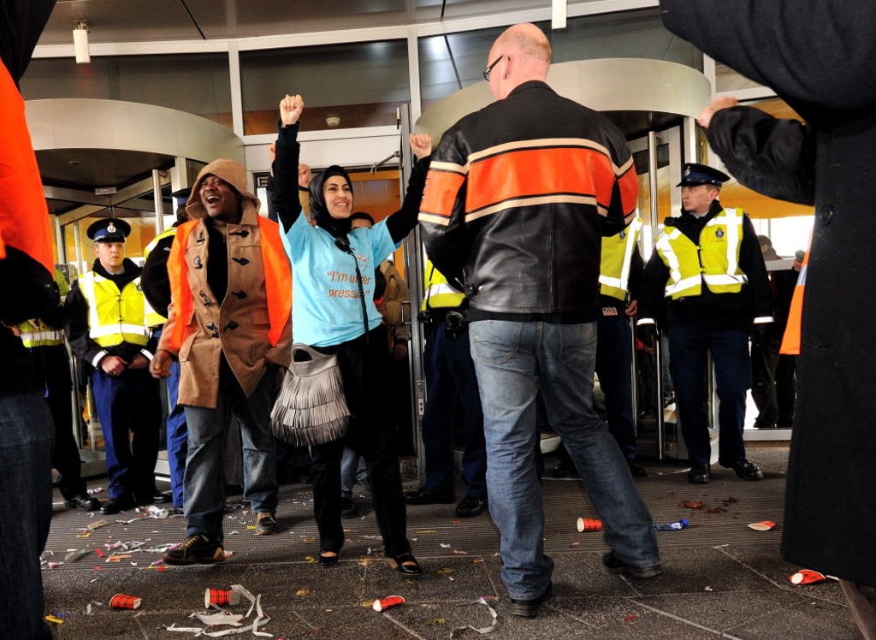
Question: Can you confirm if orange reflective vest at center is smaller than high-visibility yellow safety vest at left?

Choices:
 (A) yes
 (B) no

Answer: (B)

Question: Which of the following is the closest to the observer?

Choices:
 (A) high-visibility yellow vest at center
 (B) leather jacket at center
 (C) orange reflective vest at center

Answer: (B)

Question: Observing the image, what is the correct spatial positioning of high-visibility yellow vest at center in reference to yellow reflective vest at left?

Choices:
 (A) below
 (B) above

Answer: (B)

Question: Which is nearer to the leather jacket at center?

Choices:
 (A) orange reflective vest at center
 (B) high-visibility yellow safety vest at left
 (C) yellow reflective vest at left
 (D) light blue jersey at center

Answer: (D)

Question: Considering the real-world distances, which object is closest to the high-visibility yellow safety vest at center-right?

Choices:
 (A) high-visibility yellow vest at center
 (B) high-visibility yellow safety vest at left
 (C) leather jacket at center
 (D) light blue jersey at center

Answer: (A)

Question: Is orange reflective vest at center positioned behind high-visibility yellow safety vest at left?

Choices:
 (A) no
 (B) yes

Answer: (A)